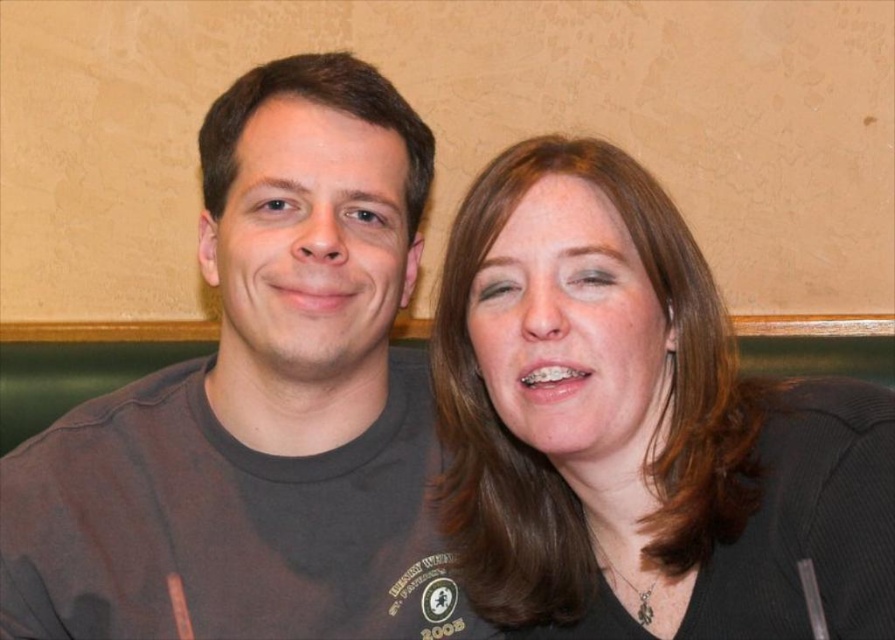
Question: Considering the relative positions of dark gray t-shirt at left and brown hair at upper right in the image provided, where is dark gray t-shirt at left located with respect to brown hair at upper right?

Choices:
 (A) right
 (B) left

Answer: (B)

Question: Does dark gray t-shirt at left come in front of brown hair at upper right?

Choices:
 (A) yes
 (B) no

Answer: (B)

Question: Which point appears closest to the camera in this image?

Choices:
 (A) (838, 573)
 (B) (84, 403)

Answer: (A)

Question: Which point is closer to the camera?

Choices:
 (A) (209, 168)
 (B) (702, 337)

Answer: (B)

Question: Considering the relative positions of dark gray t-shirt at left and brown hair at upper right in the image provided, where is dark gray t-shirt at left located with respect to brown hair at upper right?

Choices:
 (A) below
 (B) above

Answer: (B)

Question: Among these objects, which one is farthest from the camera?

Choices:
 (A) dark gray t-shirt at left
 (B) brown hair at upper right

Answer: (A)